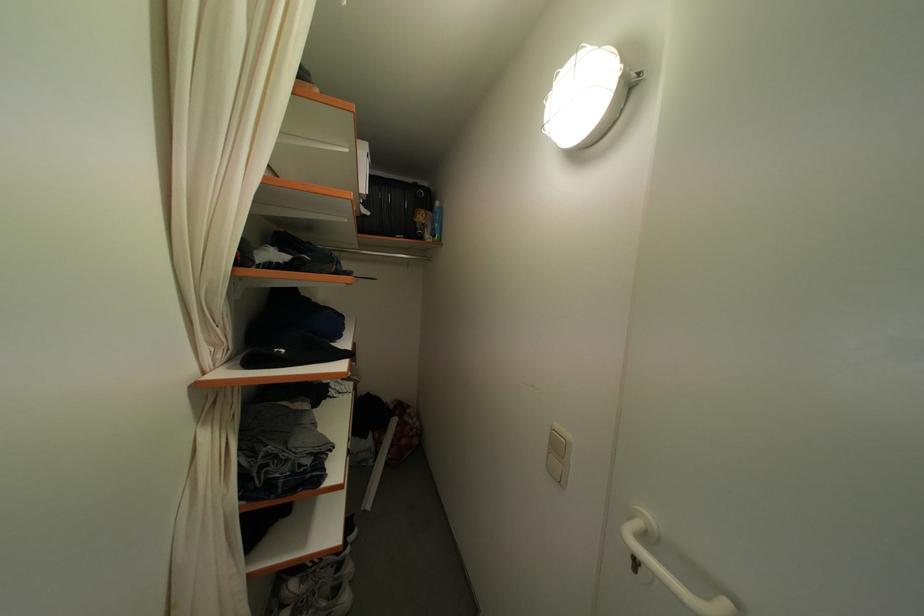
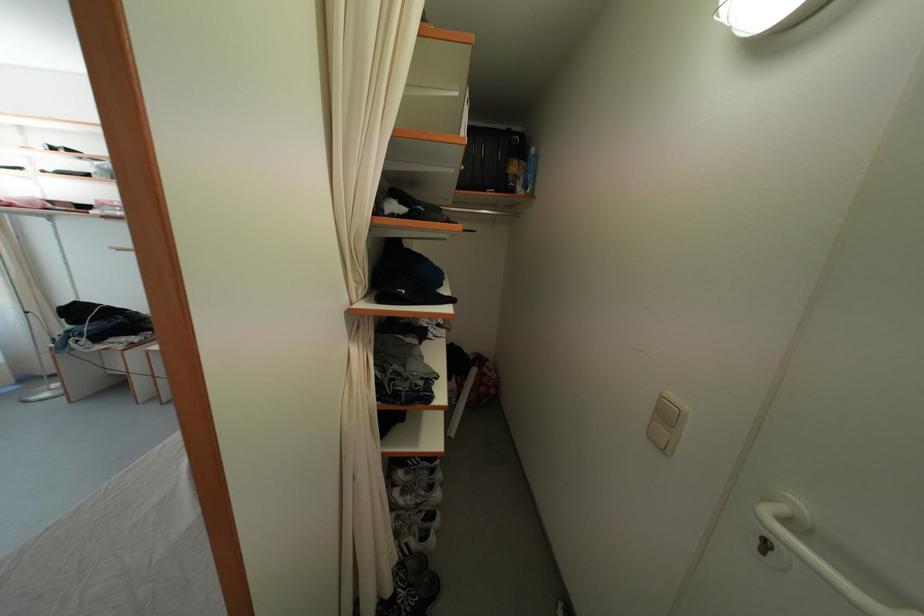
Where in the second image is the point corresponding to point 564,453 from the first image?

(672, 421)